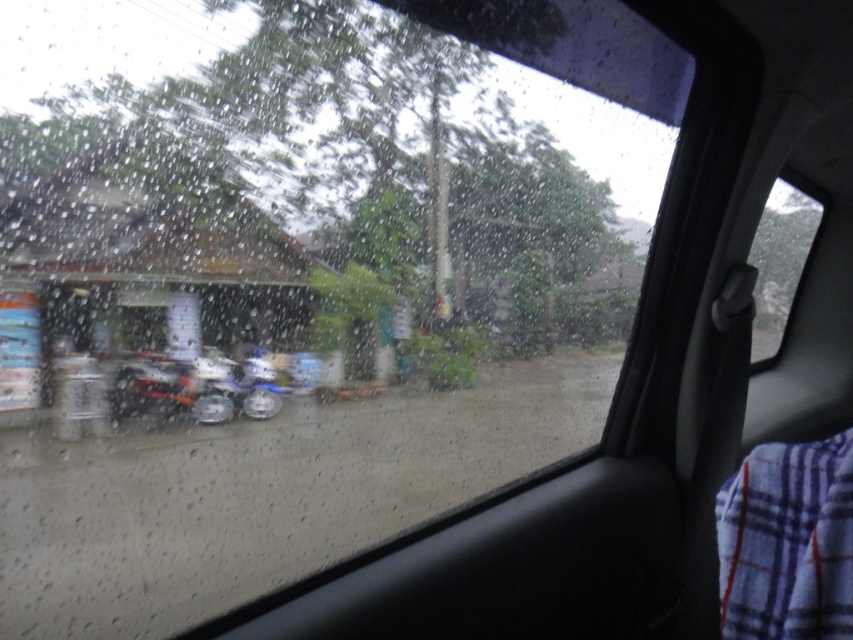
You are a passenger in the car and want to see the metallic silver motorcycle at center through the transparent glass window at center. Can you see the motorcycle clearly through the window?

The transparent glass window at center is closer to the viewer than metallic silver motorcycle at center, so the raindrops on the window may obstruct the view, making it difficult to see the motorcycle clearly.

You are a passenger in the car and want to see the metallic silver motorcycle at center through the transparent glass window at center. Can you see the motorcycle through the window?

The transparent glass window at center is to the right of metallic silver motorcycle at center, so yes, the passenger can see the metallic silver motorcycle at center through the transparent glass window at center because the window is positioned to the right of the motorcycle, allowing visibility.

You are a delivery driver who needs to check the GPS on your phone. The GPS is placed at point 0.406, 0.917. Is the GPS located on the transparent glass window at center?

The GPS is located at the same position as the transparent glass window at center, so yes, the GPS is on the transparent glass window at center.